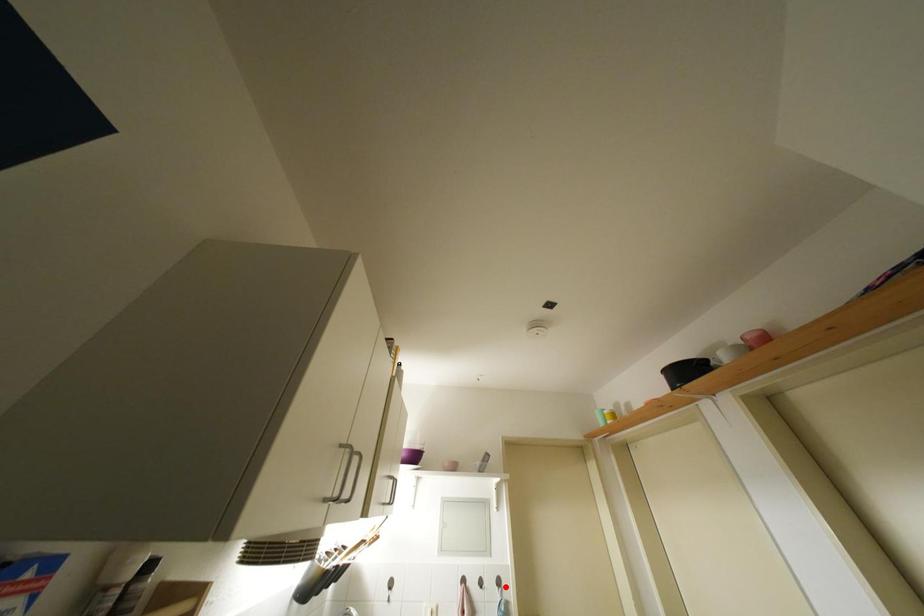
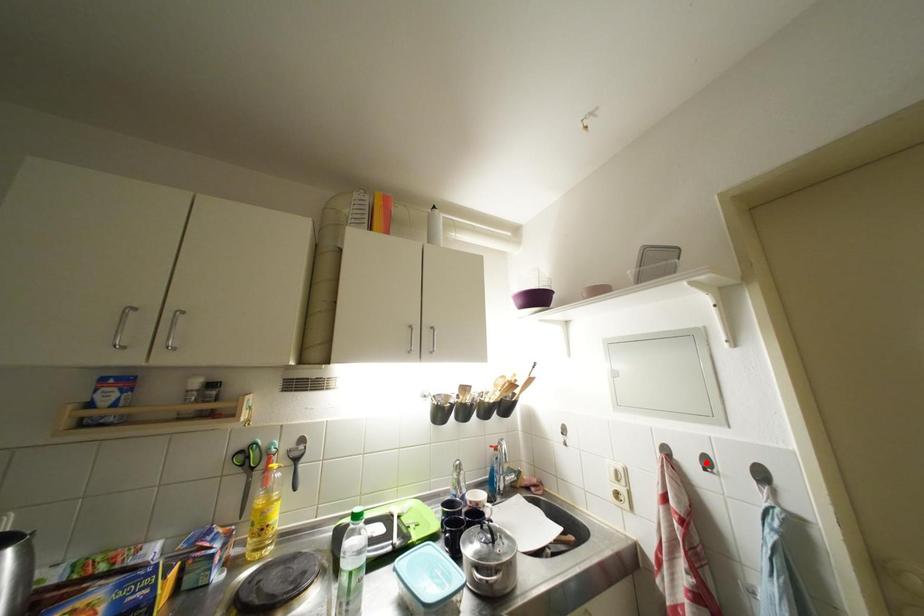
I am providing you with two images of the same scene from different viewpoints. A red point is marked on the first image and another point is marked on the second image. Is the marked point in image1 the same physical position as the marked point in image2?

No